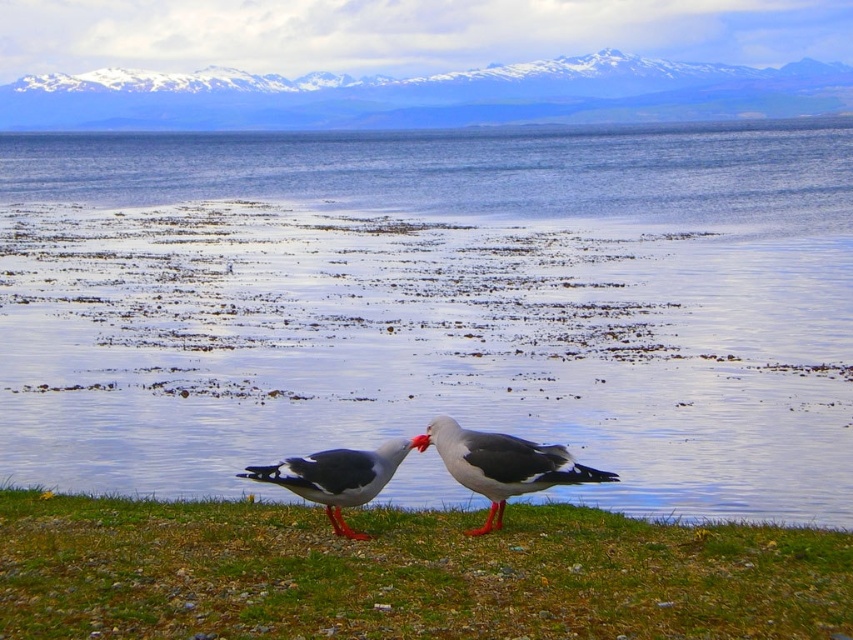
Question: Which object appears farthest from the camera in this image?

Choices:
 (A) clear water at center
 (B) gray matte seagull at center

Answer: (A)

Question: Does clear water at center appear under gray matte seagull at center?

Choices:
 (A) no
 (B) yes

Answer: (A)

Question: Which point is farther from the camera taking this photo?

Choices:
 (A) (331, 520)
 (B) (440, 451)
 (C) (746, 440)

Answer: (C)

Question: Which object is closer to the camera taking this photo?

Choices:
 (A) clear water at center
 (B) green grass at lower center
 (C) gray matte seagull at center

Answer: (B)

Question: Does gray matte seagull at center have a smaller size compared to white-feathered seagull at center?

Choices:
 (A) yes
 (B) no

Answer: (B)

Question: Can you confirm if green grass at lower center is smaller than gray matte seagull at center?

Choices:
 (A) yes
 (B) no

Answer: (B)